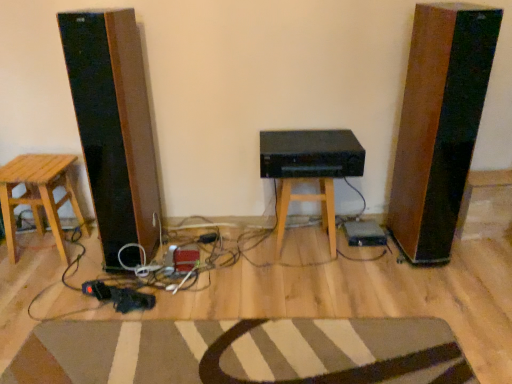
The image size is (512, 384). What are the coordinates of `vacant region above striped wool doormat at lower center (from a real-world perspective)` in the screenshot? It's located at (221, 351).